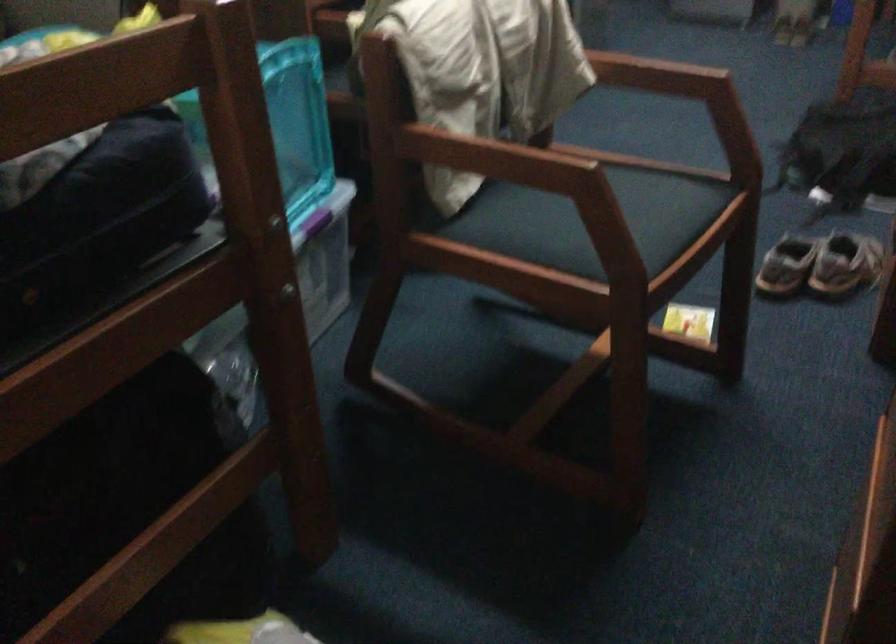
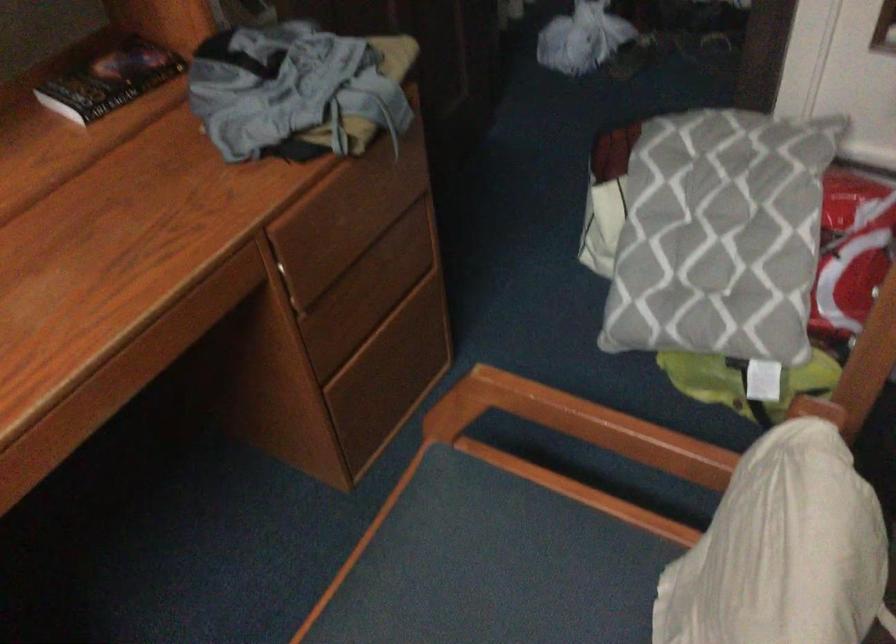
Where in the second image is the point corresponding to (x=573, y=242) from the first image?

(549, 580)